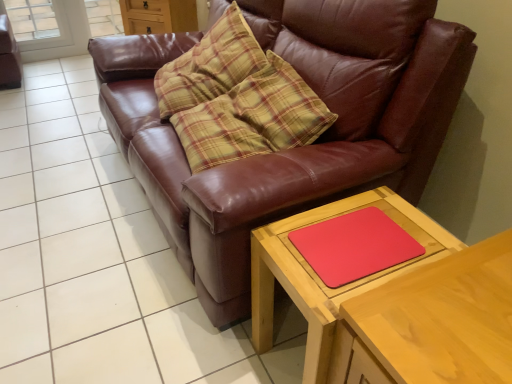
Identify the location of free spot above rubberized red mouse pad at lower right (from a real-world perspective). This screenshot has height=384, width=512. (358, 236).